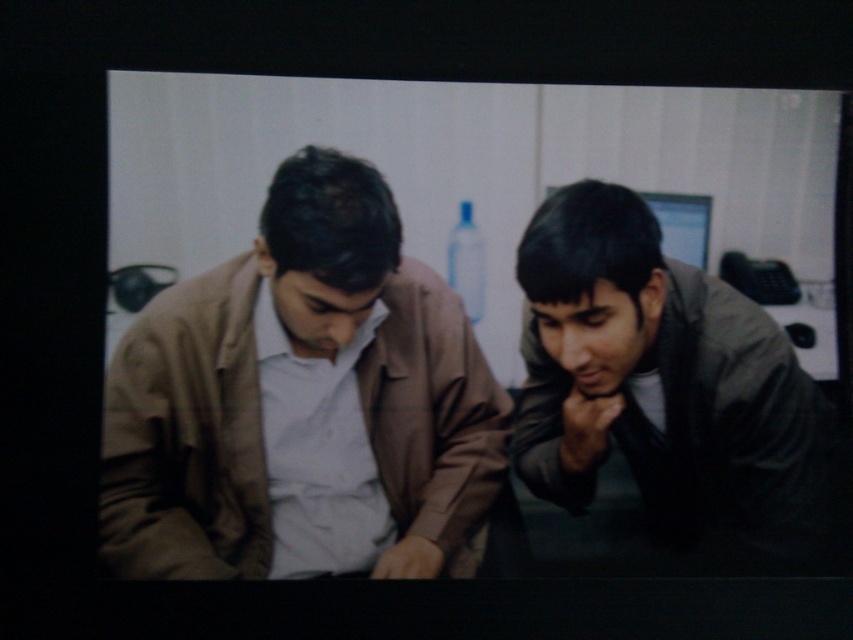
Can you confirm if matte brown jacket at left is positioned to the left of dark gray jacket at right?

Correct, you'll find matte brown jacket at left to the left of dark gray jacket at right.

Who is more forward, (415, 429) or (601, 442)?

Point (415, 429) is more forward.

You are a GUI agent. You are given a task and a screenshot of the screen. Output one action in this format:
    pyautogui.click(x=<x>, y=<y>)
    Task: Click on the matte brown jacket at left
    
    Given the screenshot: What is the action you would take?
    pyautogui.click(x=303, y=404)